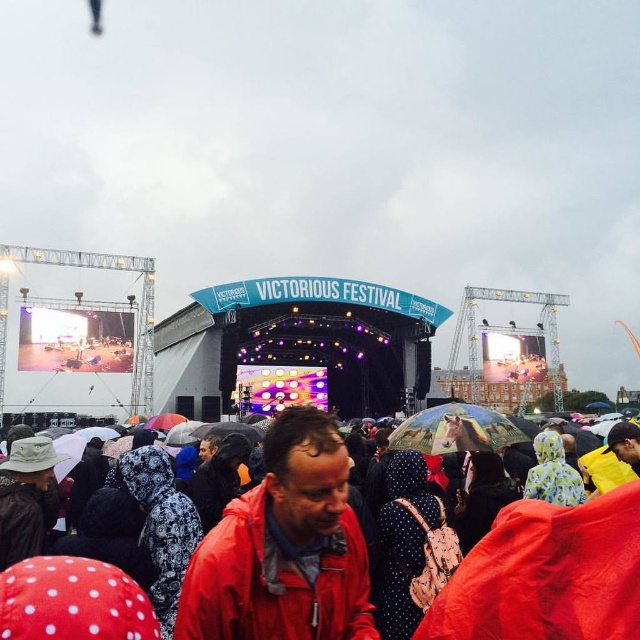
Can you confirm if red raincoat at lower center is shorter than transparent plastic umbrella at center?

No, red raincoat at lower center is not shorter than transparent plastic umbrella at center.

Which is in front, point (445, 608) or point (474, 404)?

Point (445, 608)

This screenshot has height=640, width=640. Identify the location of red raincoat at lower center. (547, 573).

Based on the photo, does red matte jacket at center appear under transparent plastic umbrella at center?

Yes.

Which of these two, red matte jacket at center or transparent plastic umbrella at center, stands shorter?

With less height is transparent plastic umbrella at center.

The width and height of the screenshot is (640, 640). In order to click on red matte jacket at center in this screenshot , I will do `click(284, 547)`.

Based on the photo, which is above, red raincoat at lower center or red matte jacket at center?

Positioned higher is red raincoat at lower center.

Is red raincoat at lower center in front of red matte jacket at center?

Yes, red raincoat at lower center is closer to the viewer.

Which is behind, point (529, 557) or point (336, 433)?

The point (336, 433) is more distant.

In order to click on red raincoat at lower center in this screenshot , I will do `click(547, 573)`.